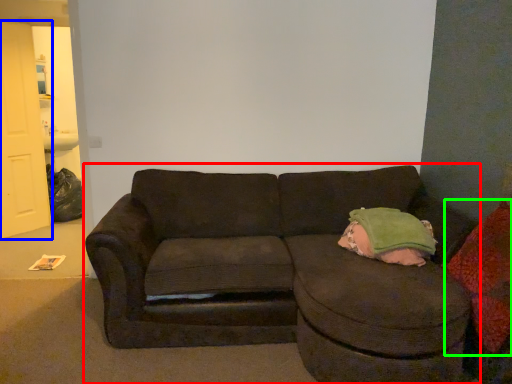
Question: Which is farther away from studio couch (highlighted by a red box)? door (highlighted by a blue box) or throw pillow (highlighted by a green box)?

Choices:
 (A) door
 (B) throw pillow

Answer: (A)